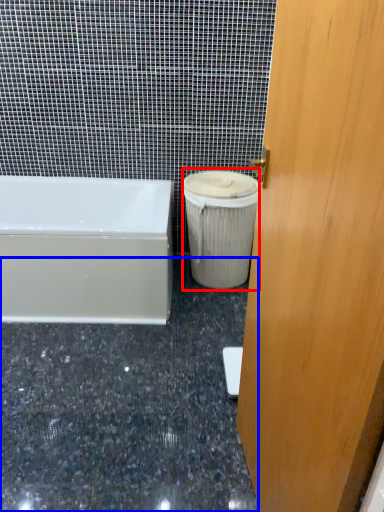
Question: Which of the following is the farthest to the observer, garbage (highlighted by a red box) or granite (highlighted by a blue box)?

Choices:
 (A) garbage
 (B) granite

Answer: (A)